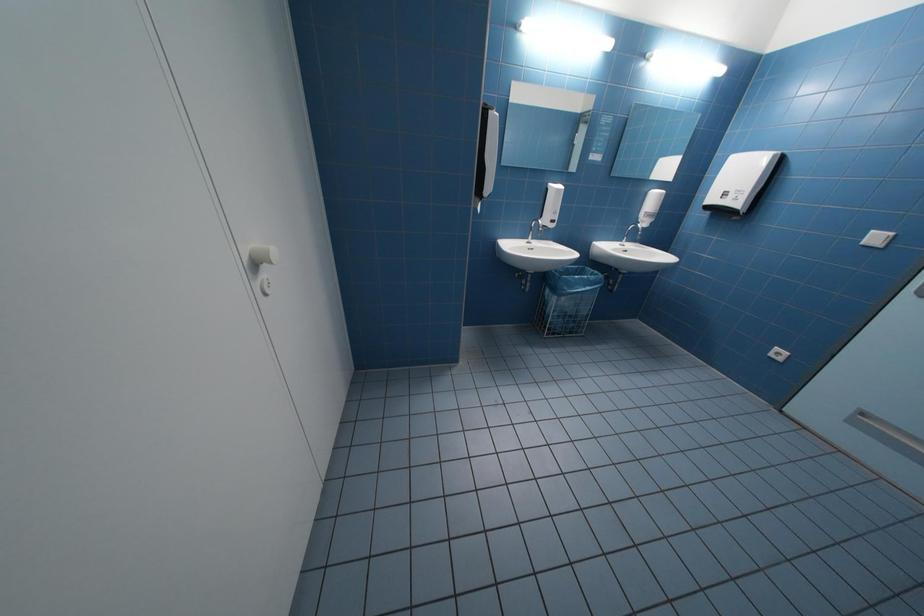
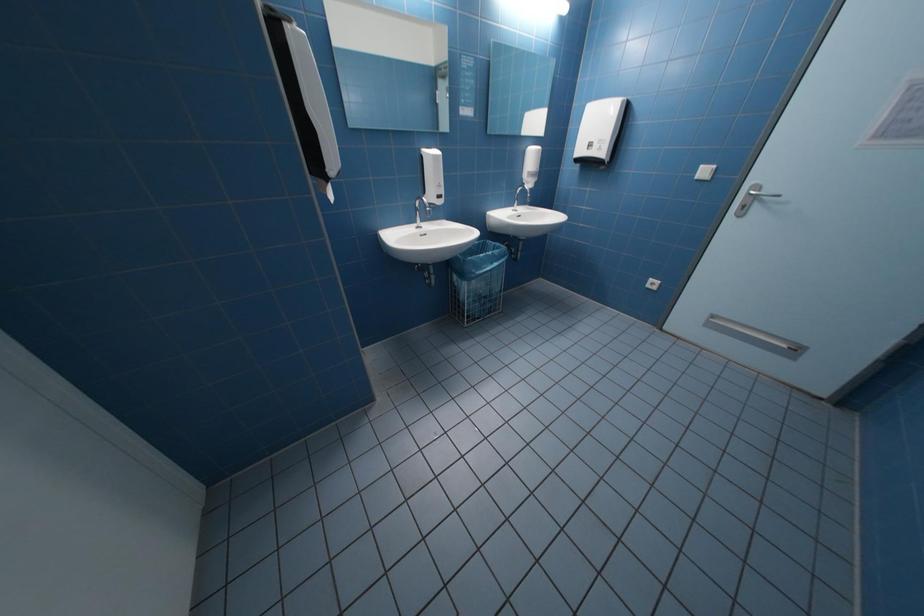
What movement of the cameraman would produce the second image?

The movement direction of the cameraman is right, forward.